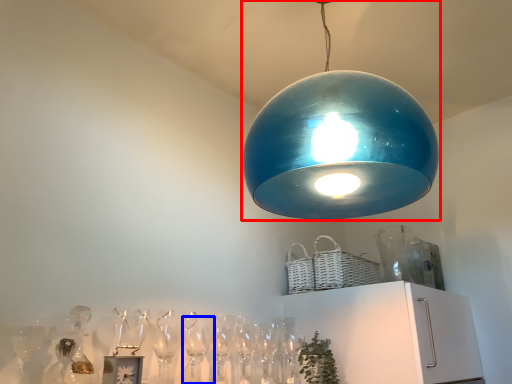
Question: Which of the following is the farthest to the observer, lamp (highlighted by a red box) or wine glass (highlighted by a blue box)?

Choices:
 (A) lamp
 (B) wine glass

Answer: (B)